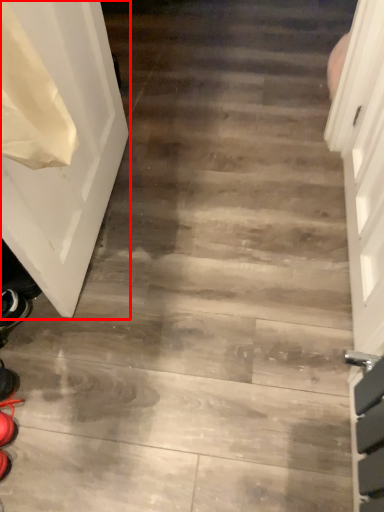
Question: From the image's perspective, considering the relative positions of door (annotated by the red box) and shoe in the image provided, where is door (annotated by the red box) located with respect to the staircase?

Choices:
 (A) below
 (B) above

Answer: (B)